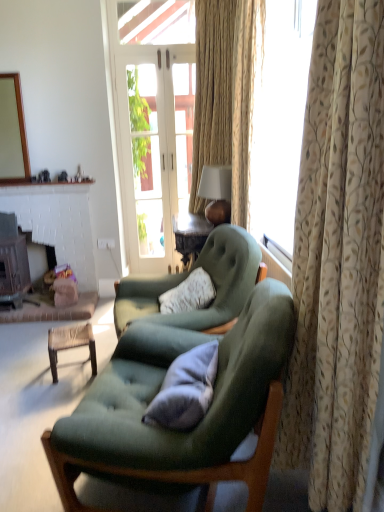
This screenshot has width=384, height=512. I want to click on vacant area on top of white brick fireplace at lower left, the first fireplace in the right-to-left sequence (from a real-world perspective), so click(x=48, y=199).